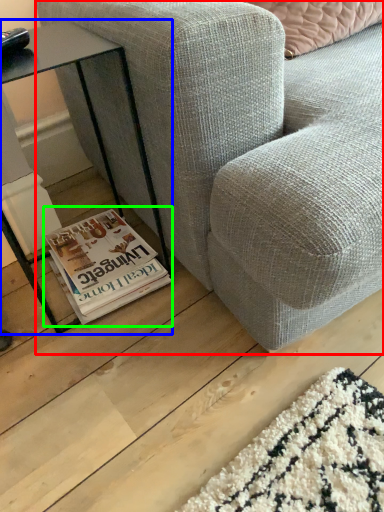
Question: Which object is the farthest from studio couch (highlighted by a red box)? Choose among these: table (highlighted by a blue box) or paperback book (highlighted by a green box).

Choices:
 (A) table
 (B) paperback book

Answer: (B)